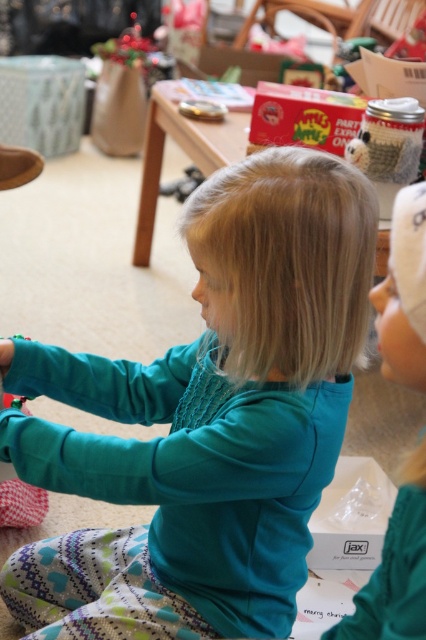
You are a parent looking for your child in a room with a teal soft shirt at center and a teal fabric toddler at center. Which object is closer to the left side of the room?

The teal soft shirt at center is closer to the left side of the room since it is positioned to the left of the teal fabric toddler at center.

You are standing in the living room and see two points marked in the image. Which point is closer to you, point (120, 452) or point (402, 561)?

Point (402, 561) is closer to you because it is in front of point (120, 452).